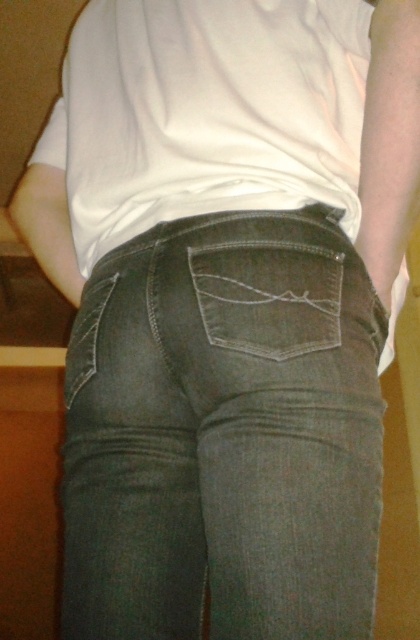
Who is taller, dark gray denim jeans at center or denim pocket at center?

With more height is dark gray denim jeans at center.

Which of these two, dark gray denim jeans at center or denim pocket at center, stands shorter?

Standing shorter between the two is denim pocket at center.

Who is more forward, (123, 577) or (238, 332)?

Point (238, 332) is in front.

Identify the location of dark gray denim jeans at center. The height and width of the screenshot is (640, 420). (225, 433).